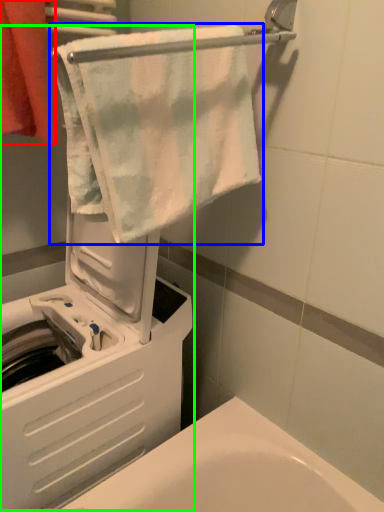
Question: Which object is positioned closest to towel (highlighted by a red box)? Select from towel (highlighted by a blue box) and machine (highlighted by a green box).

Choices:
 (A) towel
 (B) machine

Answer: (A)